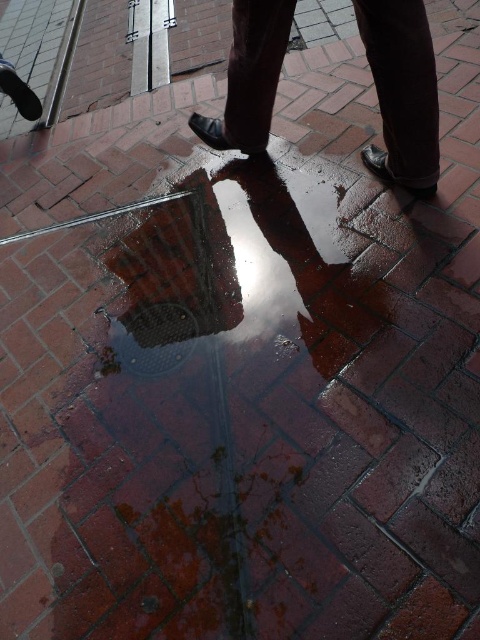
You are a pedestrian walking on the sidewalk and see the metallic grid at center and the dark brown leather shoes at center in the puddle. Which object is larger in size?

The metallic grid at center is bigger than dark brown leather shoes at center.

You are standing on the wet brick sidewalk and want to walk from point A to point B. Point A is at coordinate point (139, 269) and point B is at coordinate point (384, 122). Which point is closer to you when you start walking?

Point A at coordinate point (139, 269) is closer to you than point B at coordinate point (384, 122) because it is further to the viewer, meaning it is physically nearer in the scene.

You are a pedestrian walking on the wet sidewalk. You see the metallic grid at center and the dark brown leather shoes at center. Which object is closer to the ground?

The metallic grid at center is located below dark brown leather shoes at center, so it is closer to the ground.